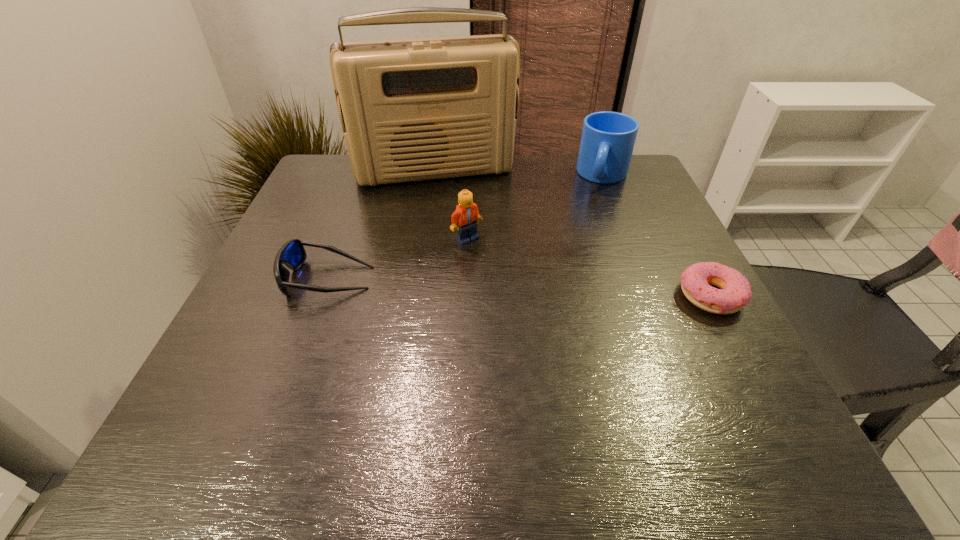
Where is `mug located at the right edge`? mug located at the right edge is located at coordinates (608, 138).

The width and height of the screenshot is (960, 540). In order to click on object present at the far left corner in this screenshot , I will do `click(419, 109)`.

Where is `object that is at the far right corner`? object that is at the far right corner is located at coordinates (608, 138).

Where is `vacant region at the far edge of the desktop`? The image size is (960, 540). vacant region at the far edge of the desktop is located at coordinates (396, 199).

What are the coordinates of `free spot at the right edge of the desktop` in the screenshot? It's located at (621, 210).

The height and width of the screenshot is (540, 960). I want to click on vacant space at the far right corner, so click(652, 184).

The width and height of the screenshot is (960, 540). Find the location of `vacant area between the shortest object and the radio receiver`. vacant area between the shortest object and the radio receiver is located at coordinates (573, 234).

I want to click on free space that is in between the third farthest object and the shortest object, so click(588, 267).

Find the location of `vacant region between the mug and the Lego`. vacant region between the mug and the Lego is located at coordinates (535, 207).

In order to click on free spot between the radio receiver and the doughnut in this screenshot , I will do `click(573, 234)`.